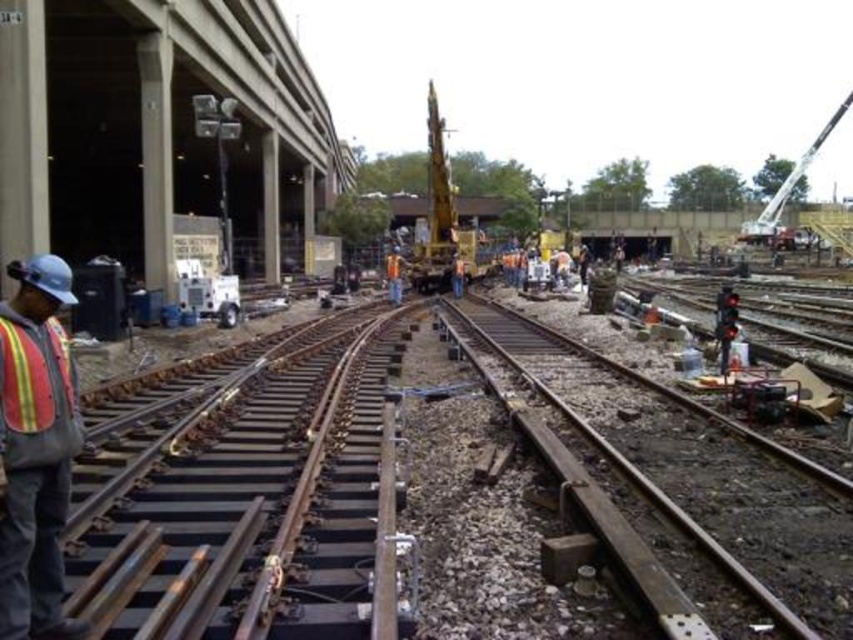
You are a railway inspector checking the construction site. You need to ensure that the smooth metal rail at center meets the minimum width requirement of 30 cm. The reflective safety vest at left is known to be 40 cm wide. Can the rail pass the inspection based on its width?

The smooth metal rail at center is less than the reflective safety vest at left in width, and since the vest is 40 cm wide, the rail must be narrower than 40 cm. However, the minimum requirement is 30 cm. Without knowing the exact width of the rail, we cannot confirm if it meets the 30 cm requirement. Further measurement is needed.

You are a worker at the construction site shown in the image. You need to locate your reflective safety vest at left. Where should you look?

The reflective safety vest at left is located at point (35,451).

You are a construction worker standing at the railway tracks. You need to move a heavy load from the metallic silver crane at upper right to the smooth metal rail at center. In which direction should you move the load?

You should move the load to the left, as the smooth metal rail at center is positioned to the left of the metallic silver crane at upper right.